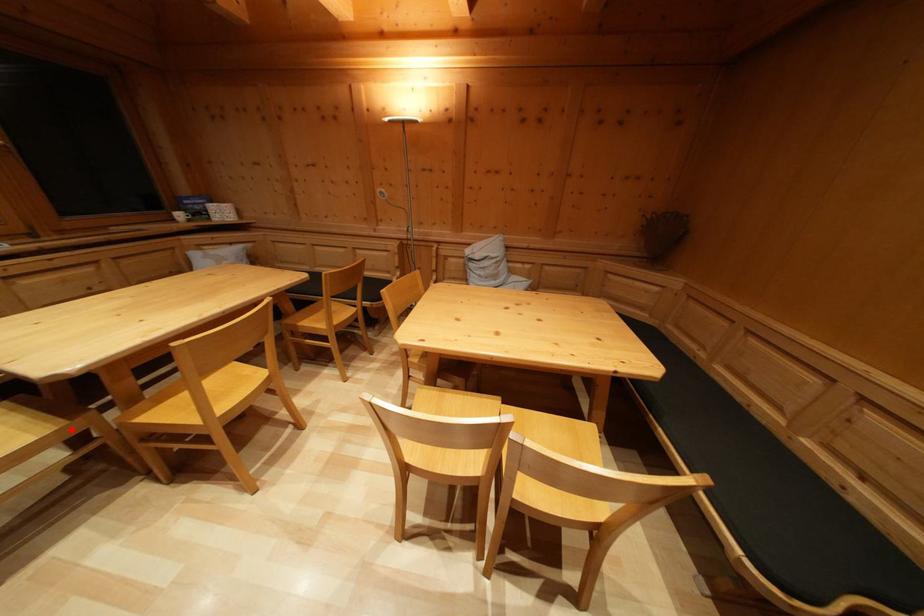
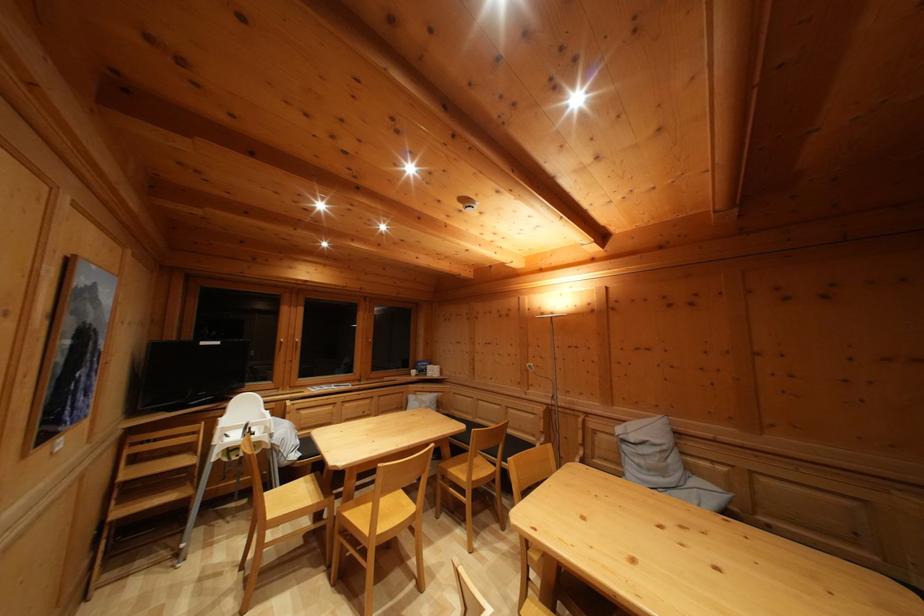
Question: I am providing you with two images of the same scene from different viewpoints. Given a red point in image1, look at the same physical point in image2. Is it:

Choices:
 (A) Closer to the viewpoint
 (B) Farther from the viewpoint

Answer: (B)